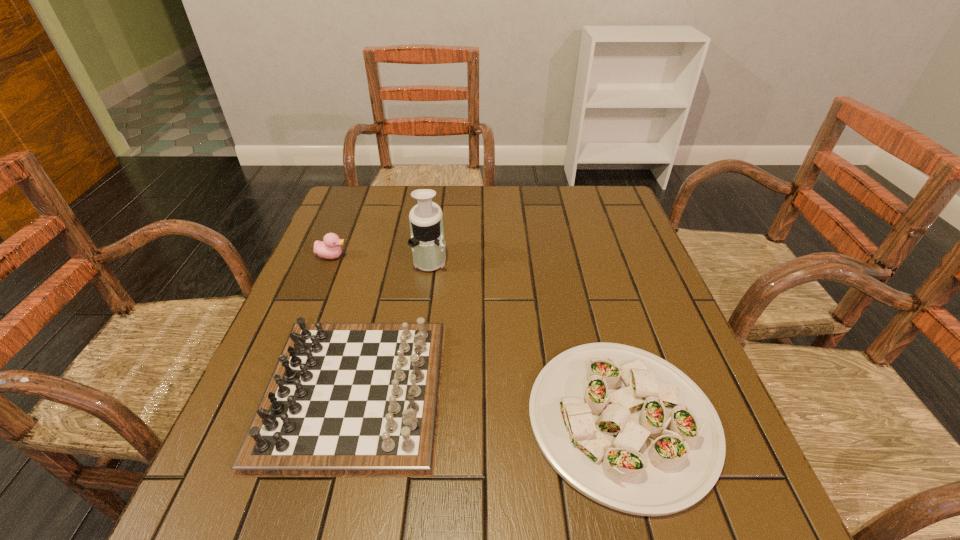
This screenshot has height=540, width=960. I want to click on juicer, so click(427, 240).

Find the location of a particular element. chessboard is located at coordinates tap(345, 399).

The image size is (960, 540). In order to click on duckling in this screenshot , I will do `click(329, 248)`.

What are the coordinates of `platter` in the screenshot? It's located at (629, 430).

Find the location of a particular element. the rightmost object is located at coordinates (629, 430).

Identify the location of vacant space situated 0.370m on the right of the tallest object. The image size is (960, 540). (586, 259).

At what (x,y) coordinates should I click in order to perform the action: click on free spot located 0.260m from the player's perspective of the chessboard. Please return your answer as a coordinate pair (x, y). This screenshot has height=540, width=960. Looking at the image, I should click on (573, 392).

In order to click on free space located 0.250m on the front-facing side of the duckling in this screenshot , I will do `click(442, 256)`.

The image size is (960, 540). What are the coordinates of `free space located on the left of the rightmost object` in the screenshot? It's located at [x=362, y=419].

Where is `object positioned at the near edge`? This screenshot has width=960, height=540. object positioned at the near edge is located at coordinates (629, 430).